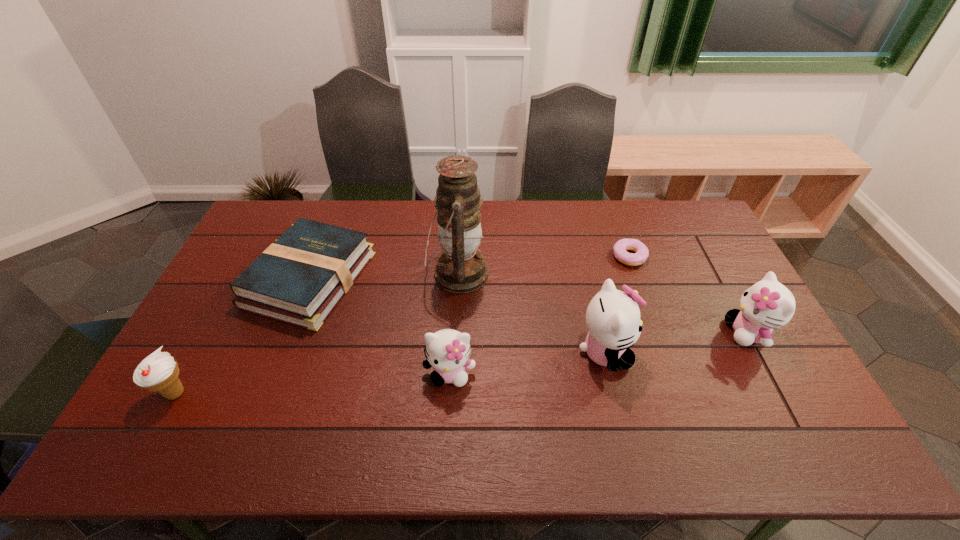
You are a GUI agent. You are given a task and a screenshot of the screen. Output one action in this format:
    pyautogui.click(x=<x>, y=<y>)
    Task: Click on the fifth closest object to the tallest object
    
    Given the screenshot: What is the action you would take?
    pyautogui.click(x=158, y=372)

You are a GUI agent. You are given a task and a screenshot of the screen. Output one action in this format:
    pyautogui.click(x=<x>, y=<y>)
    Task: Click on the kitten that can be found as the second closest to the rightmost object
    Image resolution: width=960 pixels, height=540 pixels.
    Given the screenshot: What is the action you would take?
    pyautogui.click(x=448, y=351)

I want to click on kitten that can be found as the closest to the leftmost kitten, so click(x=613, y=320).

The width and height of the screenshot is (960, 540). I want to click on blank space that satisfies the following two spatial constraints: 1. on the front-facing side of the rightmost kitten; 2. on the front-facing side of the leftmost kitten, so click(770, 373).